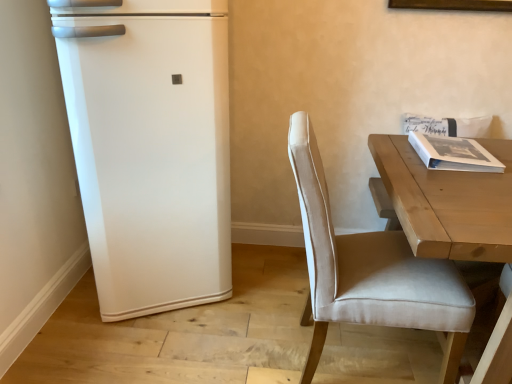
Question: Can you confirm if beige fabric chair at right is positioned to the right of light brown wooden table at right?

Choices:
 (A) yes
 (B) no

Answer: (B)

Question: Does beige fabric chair at right lie behind light brown wooden table at right?

Choices:
 (A) yes
 (B) no

Answer: (A)

Question: Could you tell me if beige fabric chair at right is turned towards light brown wooden table at right?

Choices:
 (A) yes
 (B) no

Answer: (A)

Question: Would you say beige fabric chair at right is outside light brown wooden table at right?

Choices:
 (A) no
 (B) yes

Answer: (A)

Question: Is beige fabric chair at right not close to light brown wooden table at right?

Choices:
 (A) yes
 (B) no

Answer: (B)

Question: Is point (415, 142) closer or farther from the camera than point (481, 144)?

Choices:
 (A) closer
 (B) farther

Answer: (A)

Question: Is white matte book at upper right bigger or smaller than light brown wooden table at right?

Choices:
 (A) small
 (B) big

Answer: (A)

Question: Relative to light brown wooden table at right, is white matte book at upper right in front or behind?

Choices:
 (A) front
 (B) behind

Answer: (B)

Question: From the image's perspective, is white matte book at upper right located above or below light brown wooden table at right?

Choices:
 (A) below
 (B) above

Answer: (B)

Question: Is beige fabric chair at right situated inside white matte book at upper right or outside?

Choices:
 (A) inside
 (B) outside

Answer: (B)

Question: Considering the positions of point (402, 238) and point (454, 162), is point (402, 238) closer or farther from the camera than point (454, 162)?

Choices:
 (A) closer
 (B) farther

Answer: (B)

Question: Looking at their shapes, would you say beige fabric chair at right is wider or thinner than white matte book at upper right?

Choices:
 (A) thin
 (B) wide

Answer: (B)

Question: From a real-world perspective, is beige fabric chair at right physically located above or below white matte book at upper right?

Choices:
 (A) below
 (B) above

Answer: (A)

Question: From the image's perspective, is white matte refrigerator at left positioned above or below light brown wooden table at right?

Choices:
 (A) above
 (B) below

Answer: (A)

Question: Considering the positions of white matte refrigerator at left and light brown wooden table at right in the image, is white matte refrigerator at left taller or shorter than light brown wooden table at right?

Choices:
 (A) tall
 (B) short

Answer: (A)